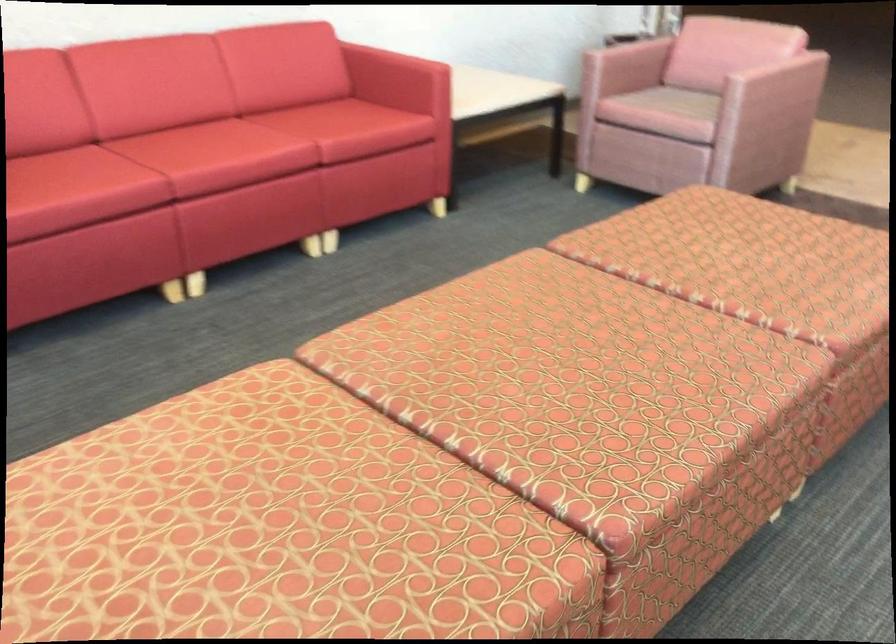
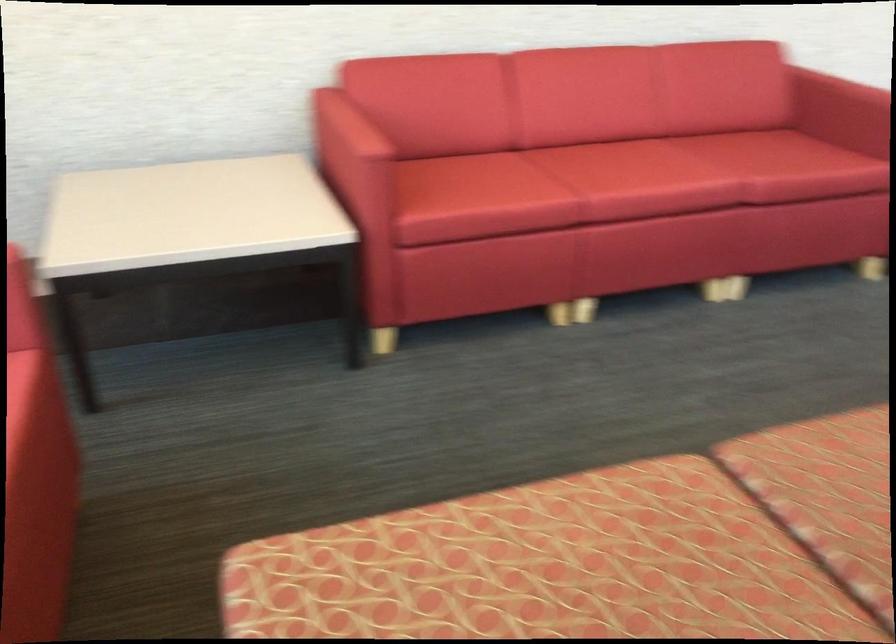
What movement of the cameraman would produce the second image?

The cameraman moved toward left, forward.